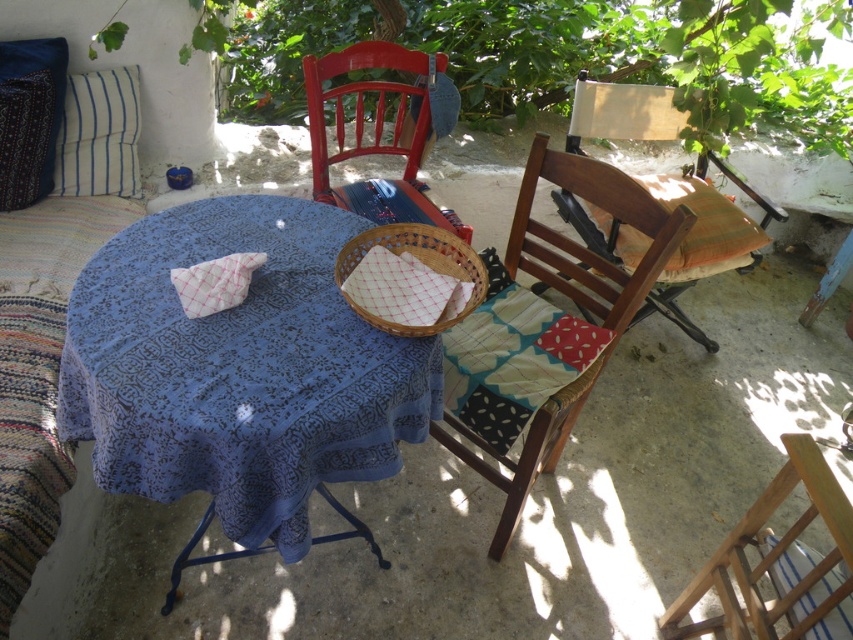
Is blue patterned fabric pillow at upper left to the right of wooden chair at right from the viewer's perspective?

In fact, blue patterned fabric pillow at upper left is to the left of wooden chair at right.

In the scene shown: Does blue patterned fabric pillow at upper left have a greater width compared to wooden chair at right?

In fact, blue patterned fabric pillow at upper left might be narrower than wooden chair at right.

Does point (22, 157) come farther from viewer compared to point (766, 236)?

No, it is in front of (766, 236).

I want to click on blue patterned fabric pillow at upper left, so click(28, 116).

Who is higher up, red checkered cloth at center or white checkered cloth at center?

Positioned higher is white checkered cloth at center.

Can you confirm if red checkered cloth at center is shorter than white checkered cloth at center?

Incorrect, red checkered cloth at center's height does not fall short of white checkered cloth at center's.

Does point (433, 252) lie behind point (193, 285)?

Yes, it is.

Image resolution: width=853 pixels, height=640 pixels. I want to click on red checkered cloth at center, so click(x=404, y=289).

Can you confirm if wooden chair at right is wider than white checkered cloth at center?

Yes.

Which is behind, point (717, 220) or point (241, 276)?

Point (717, 220)

Where is `wooden chair at right`? The image size is (853, 640). wooden chair at right is located at coordinates (704, 227).